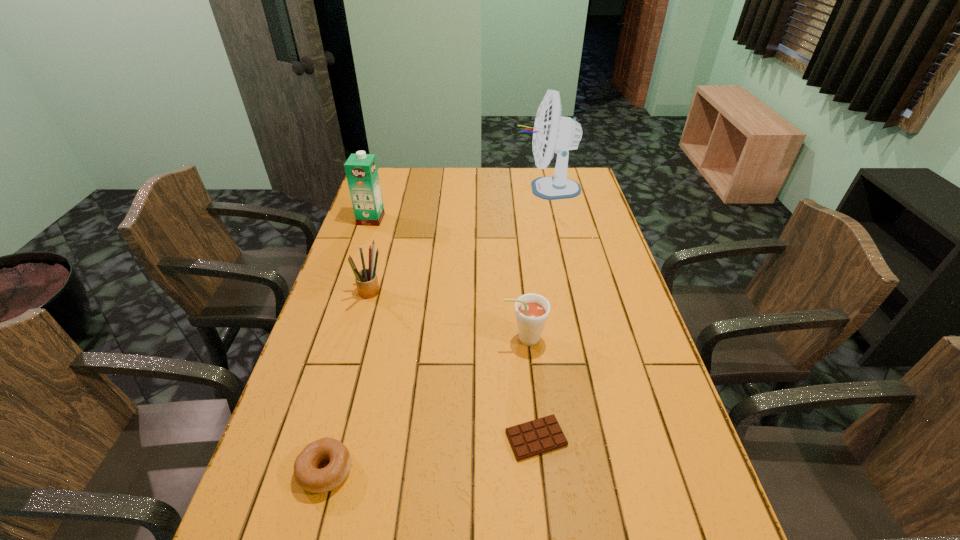
Identify the location of the farthest object. (552, 132).

Where is `the tallest object`? the tallest object is located at coordinates [x=552, y=132].

Locate an element on the screen. the fifth shortest object is located at coordinates (361, 170).

In order to click on the second farthest object in this screenshot , I will do [x=361, y=170].

Find the location of a particular element. This screenshot has width=960, height=540. the fourth farthest object is located at coordinates (532, 310).

Locate an element on the screen. Image resolution: width=960 pixels, height=540 pixels. the fourth nearest object is located at coordinates (367, 284).

You are a GUI agent. You are given a task and a screenshot of the screen. Output one action in this format:
    pyautogui.click(x=<x>, y=<y>)
    Task: Click on the bagel
    The image size is (960, 540).
    Given the screenshot: What is the action you would take?
    pyautogui.click(x=306, y=473)

Find the location of a particular element. This screenshot has width=960, height=540. candy bar is located at coordinates (542, 435).

I want to click on vacant space located 0.270m on the grille of the tallest object, so click(448, 188).

Where is `free space located 0.330m on the grille of the tallest object`? The height and width of the screenshot is (540, 960). free space located 0.330m on the grille of the tallest object is located at coordinates (433, 188).